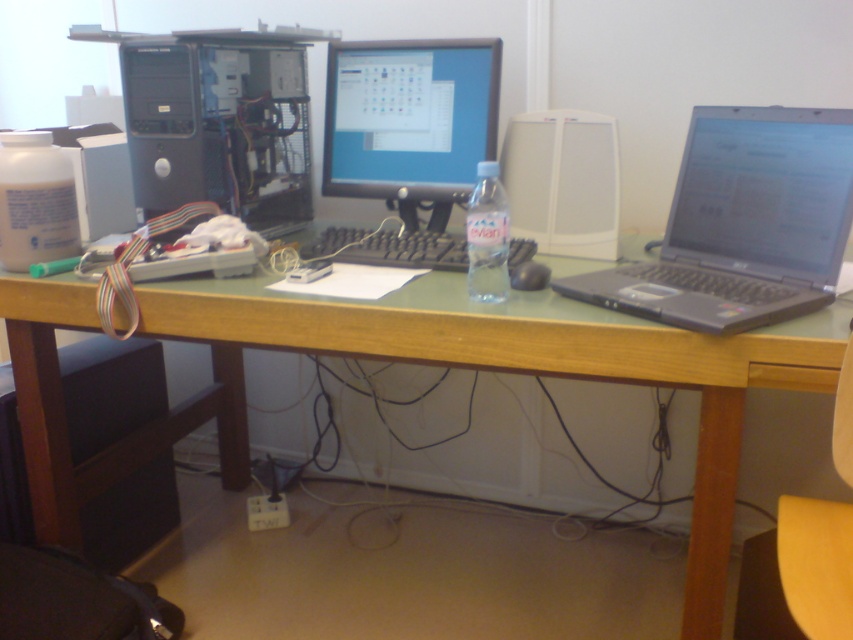
Between green wood computer desk at center and black matte keyboard at center, which one appears on the left side from the viewer's perspective?

Positioned to the left is green wood computer desk at center.

Locate an element on the screen. green wood computer desk at center is located at coordinates (416, 362).

Where is `green wood computer desk at center`? green wood computer desk at center is located at coordinates (416, 362).

Which is more to the left, black matte keyboard at center or black plastic mouse at center?

black matte keyboard at center is more to the left.

What do you see at coordinates (392, 248) in the screenshot? This screenshot has width=853, height=640. I see `black matte keyboard at center` at bounding box center [392, 248].

Who is more forward, (412,259) or (514,280)?

Point (514,280)

This screenshot has width=853, height=640. I want to click on black matte keyboard at center, so click(x=392, y=248).

Is black plastic laptop at right further to the viewer compared to black matte keyboard at center?

No, black plastic laptop at right is closer to the viewer.

Is black plastic laptop at right smaller than black matte keyboard at center?

No, black plastic laptop at right is not smaller than black matte keyboard at center.

The height and width of the screenshot is (640, 853). Describe the element at coordinates (741, 224) in the screenshot. I see `black plastic laptop at right` at that location.

Identify the location of black plastic laptop at right. The width and height of the screenshot is (853, 640). (741, 224).